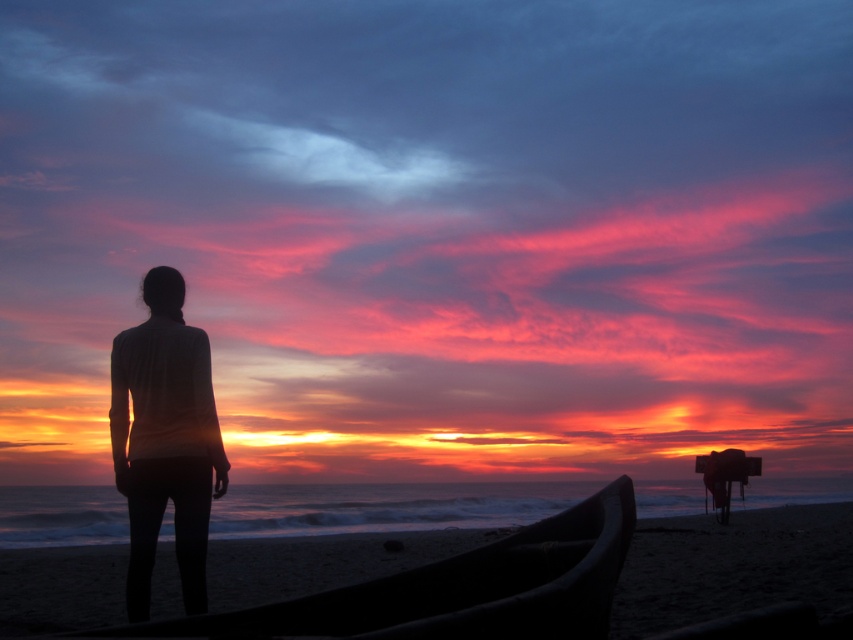
Question: Does smooth sand at lower left have a greater width compared to silhouette fabric at left?

Choices:
 (A) yes
 (B) no

Answer: (A)

Question: Which of the following is the closest to the observer?

Choices:
 (A) silhouette fabric at left
 (B) smooth sand at lower left

Answer: (A)

Question: Is smooth sand at lower left to the right of silhouette fabric at left from the viewer's perspective?

Choices:
 (A) yes
 (B) no

Answer: (A)

Question: Can you confirm if smooth sand at lower left is smaller than silhouette fabric at left?

Choices:
 (A) yes
 (B) no

Answer: (B)

Question: Which object appears closest to the camera in this image?

Choices:
 (A) smooth sand at lower left
 (B) silhouette fabric at left

Answer: (B)